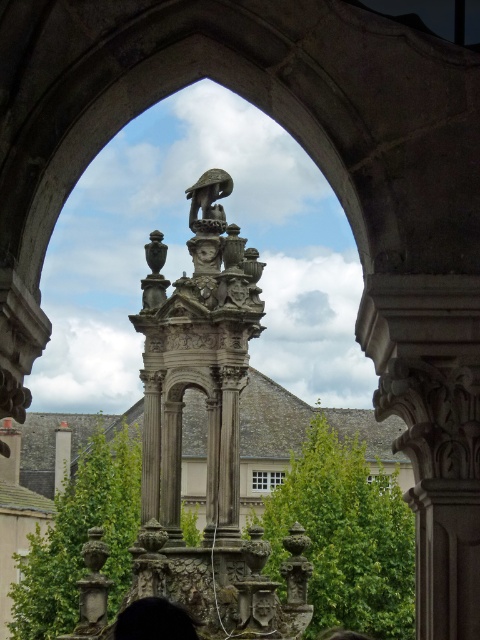
Question: Which is nearer to the white marble pillar at center?

Choices:
 (A) shiny bronze bird at center
 (B) black hair at lower center

Answer: (A)

Question: Which of these objects is positioned closest to the black hair at lower center?

Choices:
 (A) white marble pillar at center
 (B) shiny bronze bird at center

Answer: (B)

Question: Can you confirm if black hair at lower center is positioned below white marble pillar at center?

Choices:
 (A) yes
 (B) no

Answer: (A)

Question: Considering the real-world distances, which object is closest to the black hair at lower center?

Choices:
 (A) shiny bronze bird at center
 (B) white marble pillar at center

Answer: (A)

Question: Does black hair at lower center have a lesser width compared to shiny bronze bird at center?

Choices:
 (A) no
 (B) yes

Answer: (A)

Question: Can you confirm if black hair at lower center is positioned below shiny bronze bird at center?

Choices:
 (A) no
 (B) yes

Answer: (B)